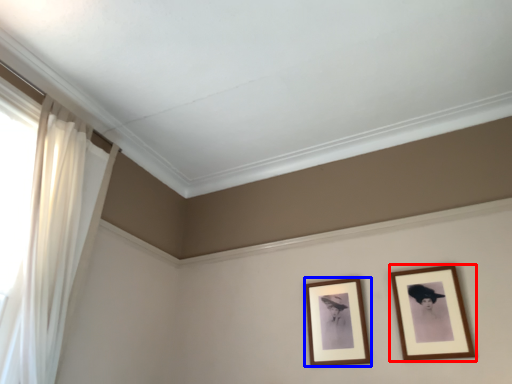
Question: Which of the following is the farthest to the observer, picture frame (highlighted by a red box) or picture frame (highlighted by a blue box)?

Choices:
 (A) picture frame
 (B) picture frame

Answer: (B)